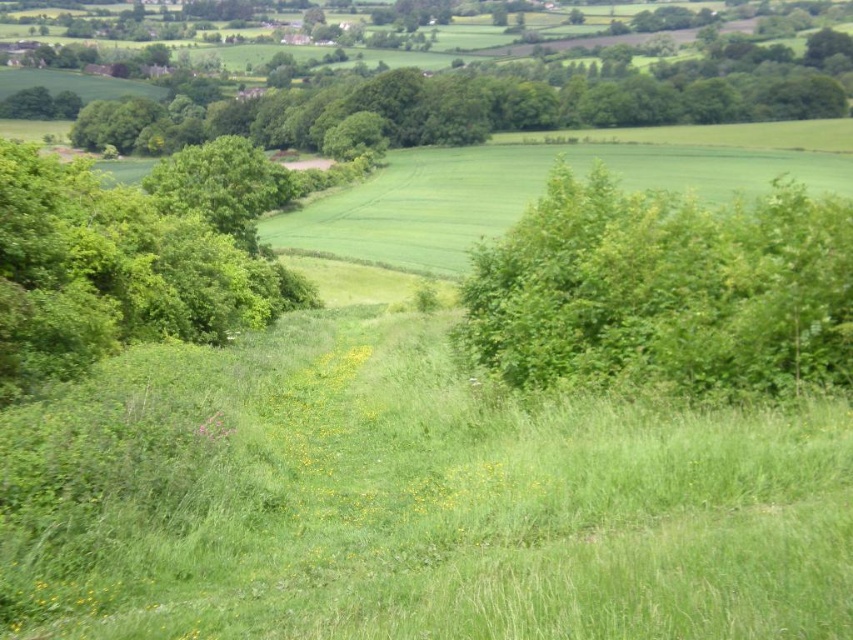
You are standing at the top of the slope in the image and want to walk to the green leafy bush at right. Which direction should you walk to avoid the green leafy tree at left?

To reach the green leafy bush at right while avoiding the green leafy tree at left, you should walk towards the right side of the slope since the bush is positioned under the tree, indicating it is located to the right relative to the tree.